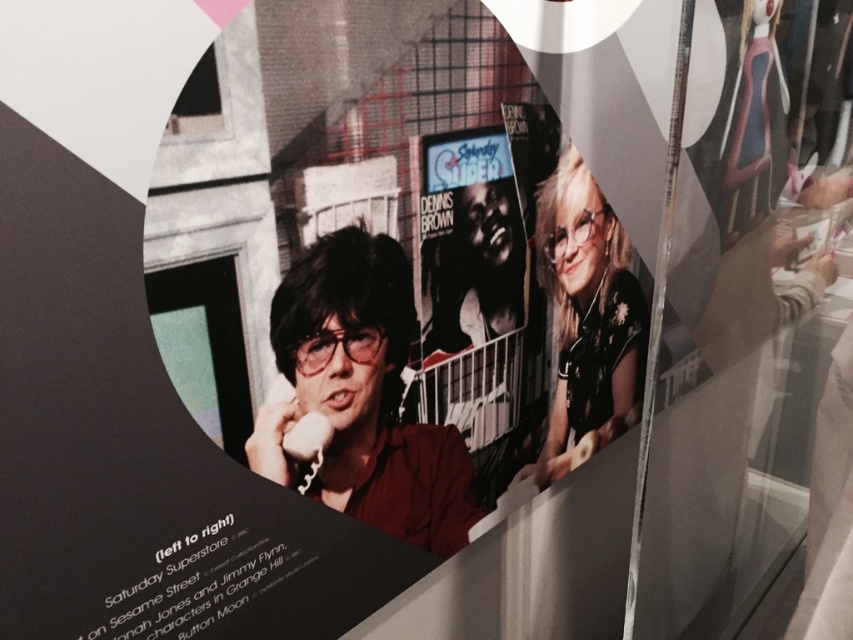
Does matte black man at center have a lesser width compared to black glossy poster at center?

In fact, matte black man at center might be wider than black glossy poster at center.

Which is behind, point (395, 317) or point (518, 218)?

The point (518, 218) is more distant.

Image resolution: width=853 pixels, height=640 pixels. I want to click on matte black man at center, so click(363, 396).

Is matte black man at center to the right of matte black glasses at center from the viewer's perspective?

No, matte black man at center is not to the right of matte black glasses at center.

From the picture: Does matte black man at center appear over matte black glasses at center?

Incorrect, matte black man at center is not positioned above matte black glasses at center.

Does point (408, 460) lie behind point (606, 301)?

No, it is in front of (606, 301).

The height and width of the screenshot is (640, 853). Identify the location of matte black man at center. (363, 396).

Who is higher up, matte black glasses at center or black glossy poster at center?

black glossy poster at center

Locate an element on the screen. The width and height of the screenshot is (853, 640). matte black glasses at center is located at coordinates (587, 316).